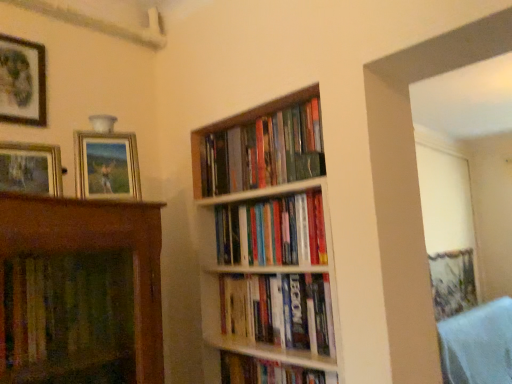
Question: Which direction should I rotate to look at hardcover books at center, which is counted as the second book, starting from the top, — up or down?

Choices:
 (A) up
 (B) down

Answer: (B)

Question: Does hardcover books at center, arranged as the 1th book when viewed from the top, have a greater width compared to hardcover books at center, positioned as the third book in bottom-to-top order?

Choices:
 (A) yes
 (B) no

Answer: (B)

Question: From the image's perspective, does hardcover books at center, which appears as the 4th book when ordered from the bottom, appear lower than hardcover books at center, which is counted as the second book, starting from the top?

Choices:
 (A) yes
 (B) no

Answer: (B)

Question: Can we say hardcover books at center, arranged as the 1th book when viewed from the top, lies outside hardcover books at center, positioned as the third book in bottom-to-top order?

Choices:
 (A) no
 (B) yes

Answer: (B)

Question: Can you confirm if hardcover books at center, arranged as the 1th book when viewed from the top, is positioned to the left of hardcover books at center, which is counted as the second book, starting from the top?

Choices:
 (A) yes
 (B) no

Answer: (A)

Question: Can you confirm if hardcover books at center, which appears as the 4th book when ordered from the bottom, is bigger than hardcover books at center, which is counted as the second book, starting from the top?

Choices:
 (A) no
 (B) yes

Answer: (B)

Question: Is hardcover books at center, which appears as the 4th book when ordered from the bottom, positioned behind hardcover books at center, positioned as the third book in bottom-to-top order?

Choices:
 (A) no
 (B) yes

Answer: (B)

Question: Is matte wooden picture frame at left, the 2th picture frame when ordered from right to left, wider than hardcover books at center, the second book positioned from the bottom?

Choices:
 (A) no
 (B) yes

Answer: (A)

Question: Are matte wooden picture frame at left, the 2th picture frame when ordered from right to left, and hardcover books at center, the second book positioned from the bottom, far apart?

Choices:
 (A) no
 (B) yes

Answer: (A)

Question: From a real-world perspective, does matte wooden picture frame at left, which ranks as the second picture frame in left-to-right order, sit lower than hardcover books at center, the 3th book from the top?

Choices:
 (A) no
 (B) yes

Answer: (A)

Question: From the image's perspective, would you say matte wooden picture frame at left, positioned as the third picture frame in back-to-front order, is positioned over hardcover books at center, the second book positioned from the bottom?

Choices:
 (A) no
 (B) yes

Answer: (B)

Question: Is matte wooden picture frame at left, which ranks as the first picture frame in front-to-back order, in contact with hardcover books at center, the 3th book from the top?

Choices:
 (A) yes
 (B) no

Answer: (B)

Question: Does matte wooden picture frame at left, positioned as the third picture frame in back-to-front order, come behind hardcover books at center, the second book positioned from the bottom?

Choices:
 (A) yes
 (B) no

Answer: (B)

Question: Is hardcover books at center, which appears as the 4th book when ordered from the bottom, facing away from matte black picture frame at upper left, which is the 1th picture frame in left-to-right order?

Choices:
 (A) no
 (B) yes

Answer: (A)